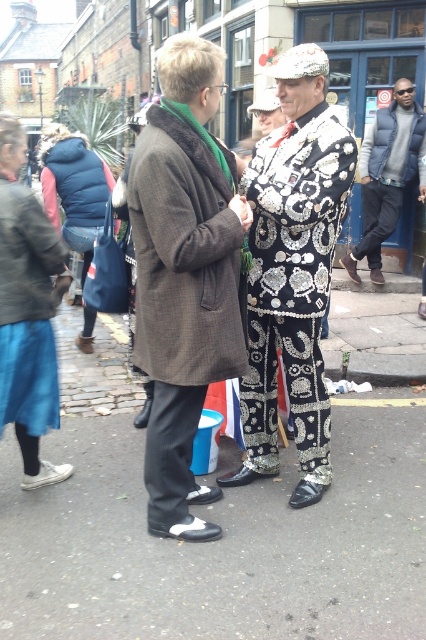
Which of these two, brown wool coat at center or denim skirt at left, stands taller?

With more height is brown wool coat at center.

At what (x,y) coordinates should I click in order to perform the action: click on brown wool coat at center. Please return your answer as a coordinate pair (x, y). The width and height of the screenshot is (426, 640). Looking at the image, I should click on (184, 275).

Find the location of a particular element. Image resolution: width=426 pixels, height=640 pixels. brown wool coat at center is located at coordinates (184, 275).

Which is below, black rubber shoes at lower center or matte black jacket at right?

black rubber shoes at lower center is lower down.

This screenshot has height=640, width=426. Identify the location of black rubber shoes at lower center. (219, 544).

Which is behind, point (183, 449) or point (414, 112)?

Point (414, 112)

Can you confirm if brown wool coat at center is bigger than matte black jacket at right?

Incorrect, brown wool coat at center is not larger than matte black jacket at right.

You are a GUI agent. You are given a task and a screenshot of the screen. Output one action in this format:
    pyautogui.click(x=<x>, y=<y>)
    Task: Click on the brown wool coat at center
    
    Given the screenshot: What is the action you would take?
    [184, 275]

The image size is (426, 640). In order to click on brown wool coat at center in this screenshot , I will do `click(184, 275)`.